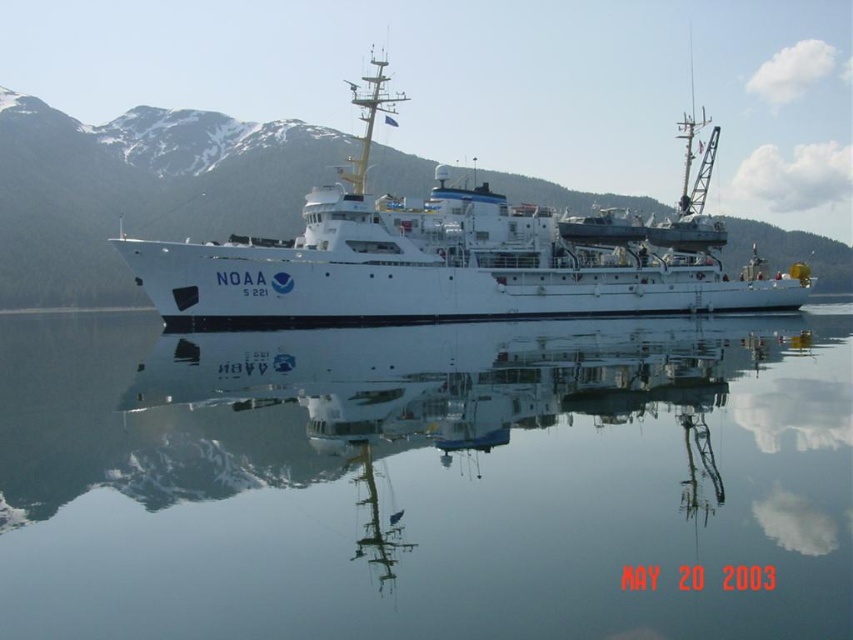
Question: Which of the following is the closest to the observer?

Choices:
 (A) (230, 300)
 (B) (635, 502)

Answer: (B)

Question: Where is clear glass water at center located in relation to white matte ship at center in the image?

Choices:
 (A) right
 (B) left

Answer: (B)

Question: Which object appears farthest from the camera in this image?

Choices:
 (A) clear glass water at center
 (B) white matte ship at center

Answer: (B)

Question: Is clear glass water at center above white matte ship at center?

Choices:
 (A) yes
 (B) no

Answer: (B)

Question: Among these points, which one is nearest to the camera?

Choices:
 (A) (744, 368)
 (B) (289, 269)

Answer: (A)

Question: Does clear glass water at center lie behind white matte ship at center?

Choices:
 (A) no
 (B) yes

Answer: (A)